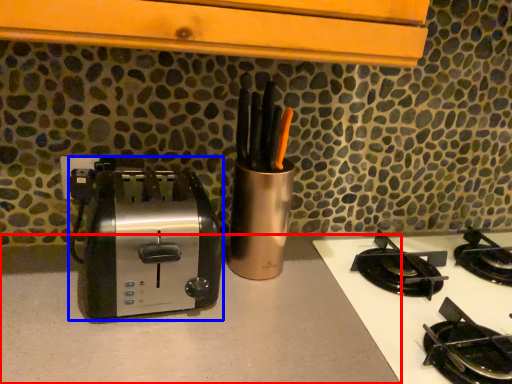
Question: Among these objects, which one is nearest to the camera, counter top (highlighted by a red box) or toaster (highlighted by a blue box)?

Choices:
 (A) counter top
 (B) toaster

Answer: (A)